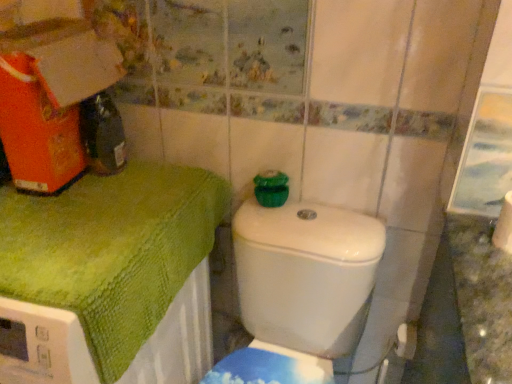
Question: Can you confirm if green textured towel at upper left is shorter than white matte toilet paper at lower right, marked as the second toilet paper in a front-to-back arrangement?

Choices:
 (A) no
 (B) yes

Answer: (A)

Question: Considering the relative sizes of green textured towel at upper left and white matte toilet paper at lower right, which ranks as the second toilet paper in top-to-bottom order, in the image provided, is green textured towel at upper left thinner than white matte toilet paper at lower right, which ranks as the second toilet paper in top-to-bottom order,?

Choices:
 (A) yes
 (B) no

Answer: (B)

Question: Can you confirm if green textured towel at upper left is positioned to the left of white matte toilet paper at lower right, marked as the second toilet paper in a front-to-back arrangement?

Choices:
 (A) no
 (B) yes

Answer: (B)

Question: Is green textured towel at upper left not close to white matte toilet paper at lower right, which ranks as the second toilet paper in top-to-bottom order?

Choices:
 (A) yes
 (B) no

Answer: (B)

Question: Is green textured towel at upper left oriented away from white matte toilet paper at lower right, which is the 1th toilet paper in back-to-front order?

Choices:
 (A) no
 (B) yes

Answer: (A)

Question: Looking at the image, does white glossy toilet at center seem bigger or smaller compared to white matte toilet paper at lower right, the 1th toilet paper positioned from the front?

Choices:
 (A) big
 (B) small

Answer: (A)

Question: From their relative heights in the image, would you say white glossy toilet at center is taller or shorter than white matte toilet paper at lower right, the second toilet paper from the back?

Choices:
 (A) tall
 (B) short

Answer: (A)

Question: Is white glossy toilet at center in front of or behind white matte toilet paper at lower right, marked as the second toilet paper in a bottom-to-top arrangement, in the image?

Choices:
 (A) behind
 (B) front

Answer: (B)

Question: Considering the relative positions of white glossy toilet at center and white matte toilet paper at lower right, the 1th toilet paper positioned from the front, in the image provided, is white glossy toilet at center to the left or to the right of white matte toilet paper at lower right, the 1th toilet paper positioned from the front,?

Choices:
 (A) right
 (B) left

Answer: (B)

Question: From a real-world perspective, is white matte toilet paper at lower right, marked as the second toilet paper in a bottom-to-top arrangement, above or below white matte toilet paper at lower right, which is the 1th toilet paper in back-to-front order?

Choices:
 (A) below
 (B) above

Answer: (B)

Question: Is white matte toilet paper at lower right, the 1th toilet paper from the top, wider or thinner than white matte toilet paper at lower right, placed as the 1th toilet paper when sorted from bottom to top?

Choices:
 (A) thin
 (B) wide

Answer: (A)

Question: Would you say white matte toilet paper at lower right, the second toilet paper from the back, is to the left or to the right of white matte toilet paper at lower right, marked as the second toilet paper in a front-to-back arrangement, in the picture?

Choices:
 (A) right
 (B) left

Answer: (A)

Question: Is white matte toilet paper at lower right, the 1th toilet paper from the top, taller or shorter than white matte toilet paper at lower right, which is the 1th toilet paper in back-to-front order?

Choices:
 (A) tall
 (B) short

Answer: (A)

Question: Would you say white glossy toilet at center is to the left or to the right of green textured towel at upper left in the picture?

Choices:
 (A) right
 (B) left

Answer: (A)

Question: In terms of height, does white glossy toilet at center look taller or shorter compared to green textured towel at upper left?

Choices:
 (A) short
 (B) tall

Answer: (A)